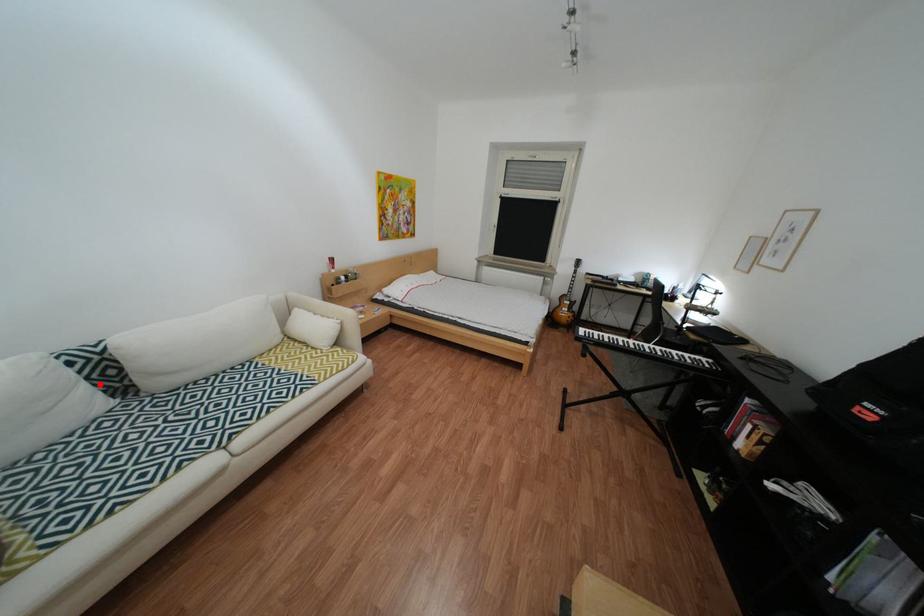
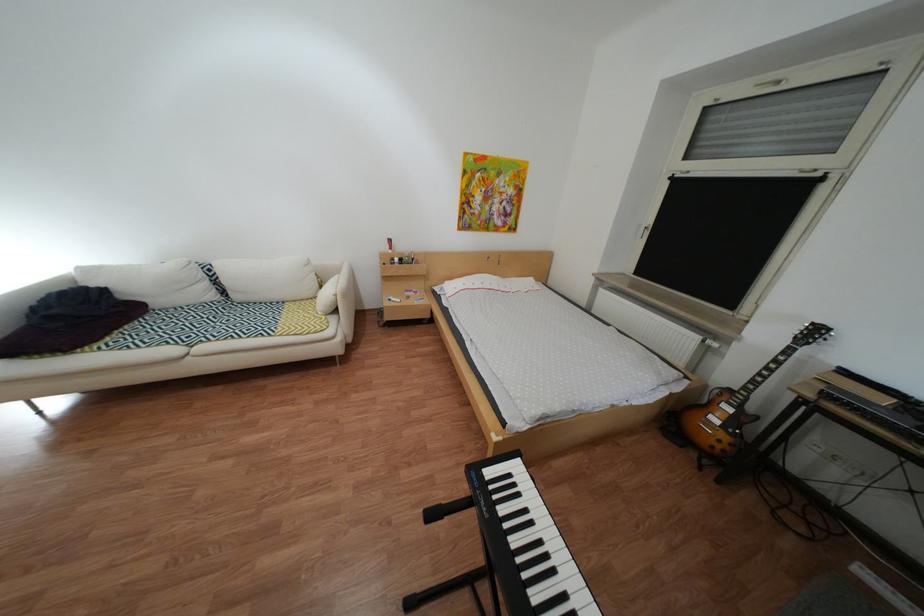
Locate, in the second image, the point that corresponds to the highlighted location in the first image.

(223, 284)